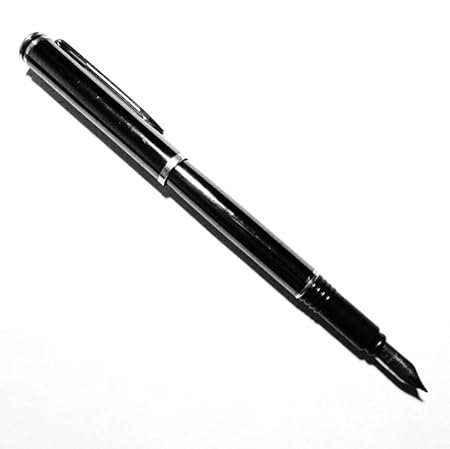
Where is `pen`? The width and height of the screenshot is (450, 449). pen is located at coordinates (225, 210).